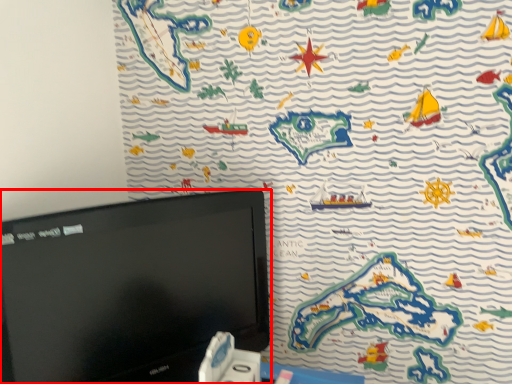
Question: From the image's perspective, considering the relative positions of computer monitor (annotated by the red box) and game controller in the image provided, where is computer monitor (annotated by the red box) located with respect to the staircase?

Choices:
 (A) above
 (B) below

Answer: (A)